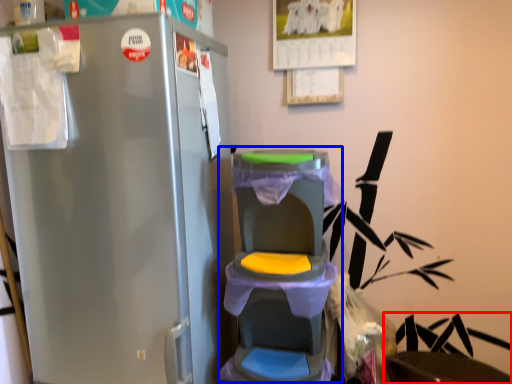
Question: Which object appears farthest to the camera in this image, swivel chair (highlighted by a red box) or baby carriage (highlighted by a blue box)?

Choices:
 (A) swivel chair
 (B) baby carriage

Answer: (A)